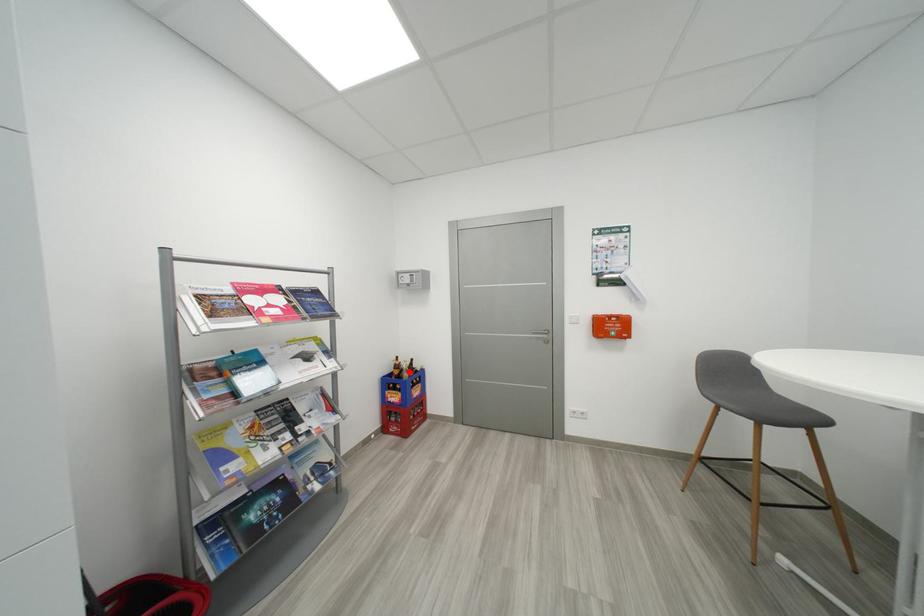
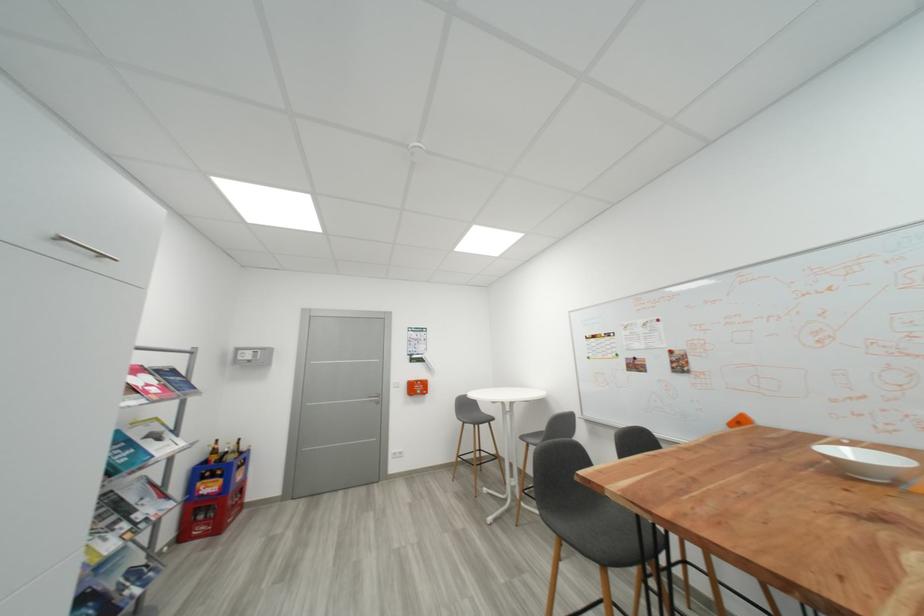
Question: I am providing you with two images of the same scene from different viewpoints. In image1, a red point is highlighted. Considering the same 3D point in image2, which of the following is correct?

Choices:
 (A) It is closer
 (B) It is farther

Answer: (A)